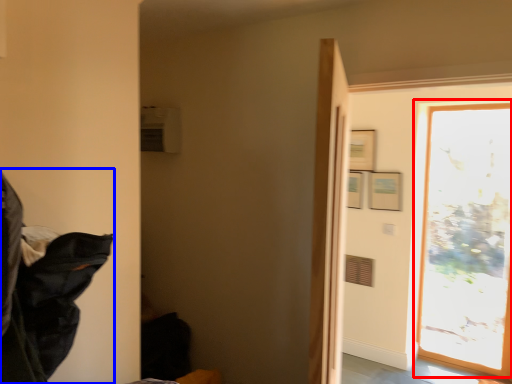
Question: Which object appears farthest to the camera in this image, window (highlighted by a red box) or laundry (highlighted by a blue box)?

Choices:
 (A) window
 (B) laundry

Answer: (A)